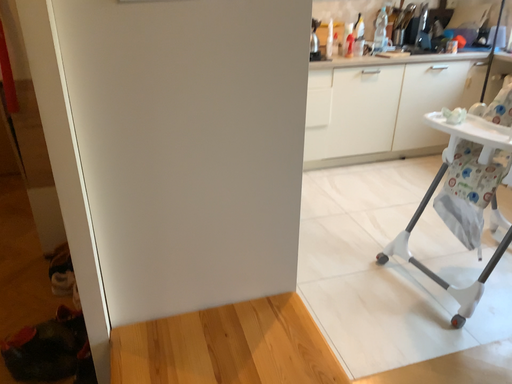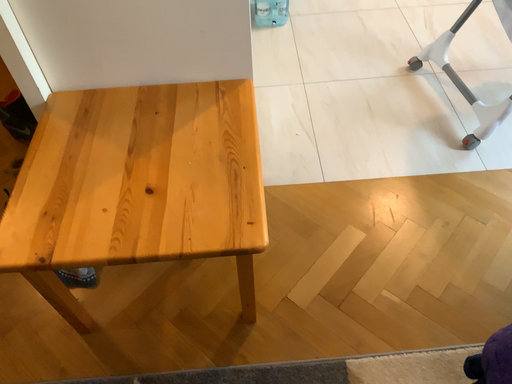
Question: How did the camera likely rotate when shooting the video?

Choices:
 (A) rotated left
 (B) rotated right

Answer: (A)